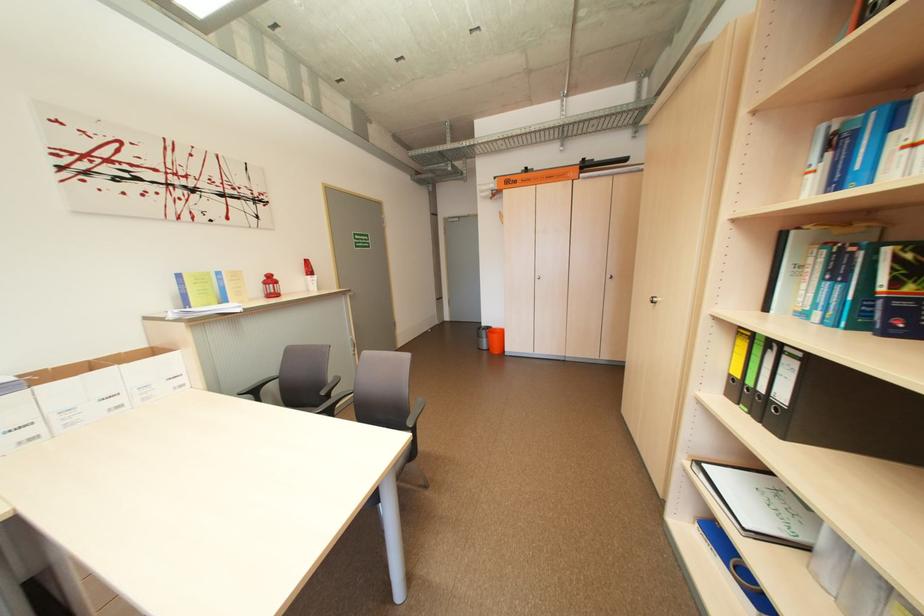
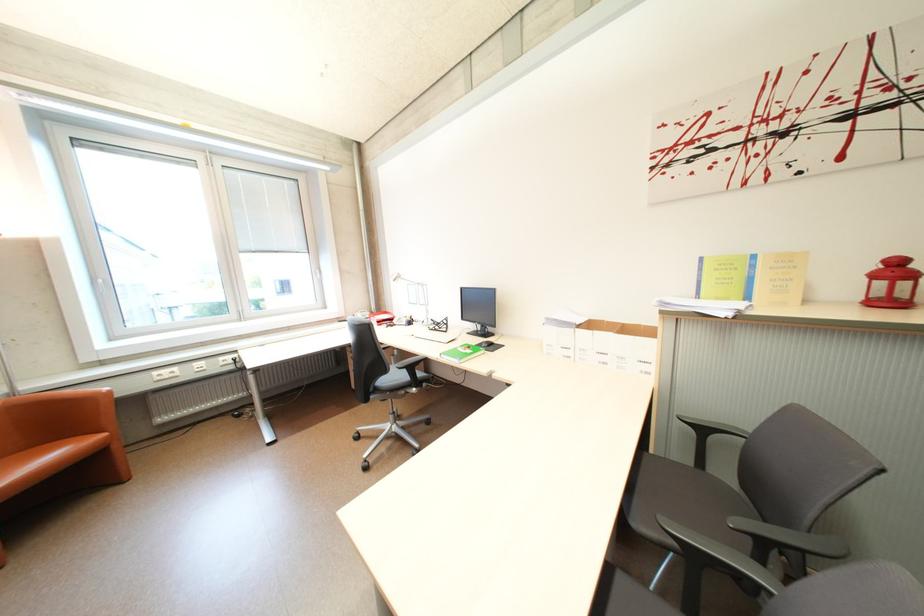
How did the camera likely rotate?

The camera rotated toward left-down.